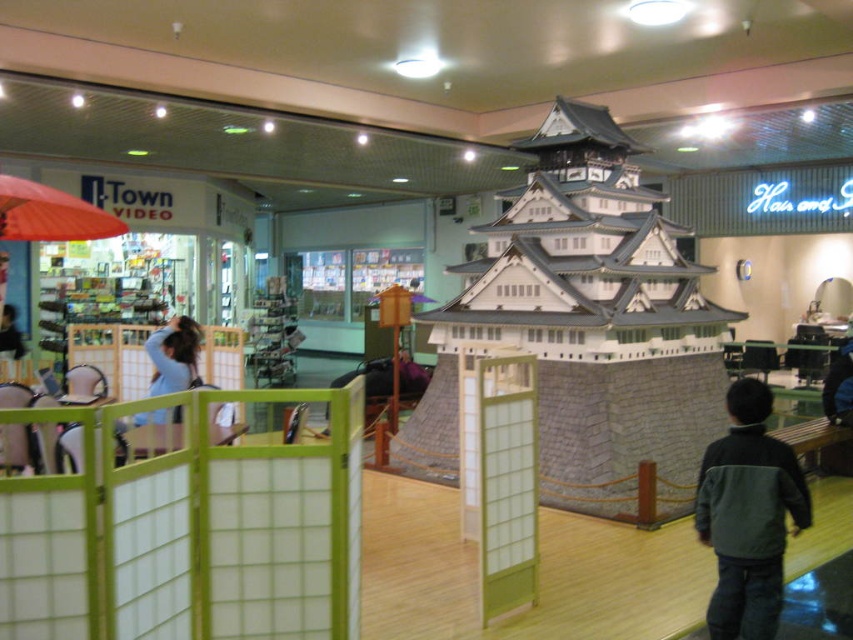
You are a visitor in the mall and want to see the traditional Japanese castle model clearly. There are two items blocking your view. Which item is closer to you, the orange fabric umbrella at upper left or the light blue fabric at left?

The orange fabric umbrella at upper left is positioned over the light blue fabric at left, so the orange fabric umbrella at upper left is closer to you.

You are standing in the shopping mall and want to buy the dark green fleece jacket at lower right. Based on its position, can you estimate whether it is placed near the entrance or deeper inside the store?

The dark green fleece jacket at lower right is located at point (747, 515), which suggests it is placed deeper inside the store rather than near the entrance.